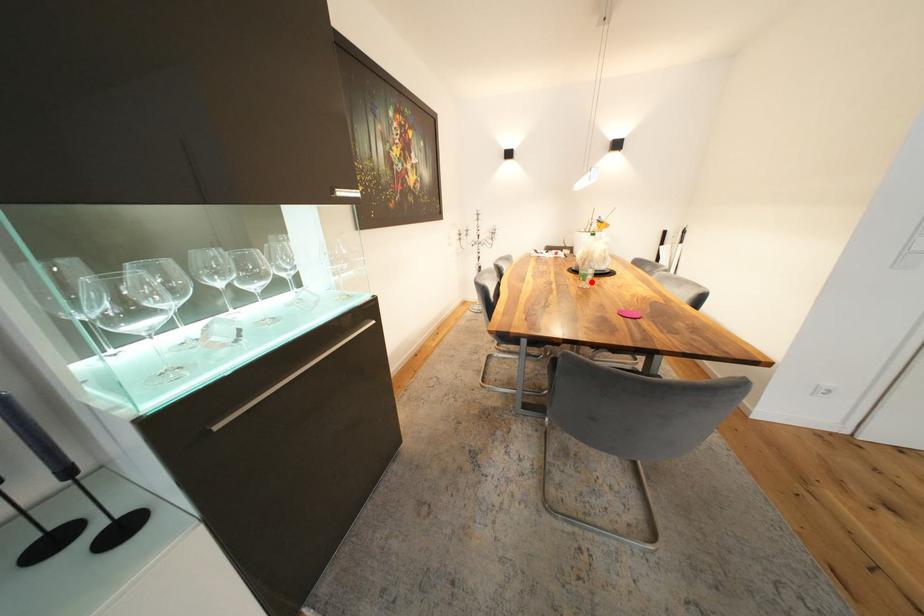
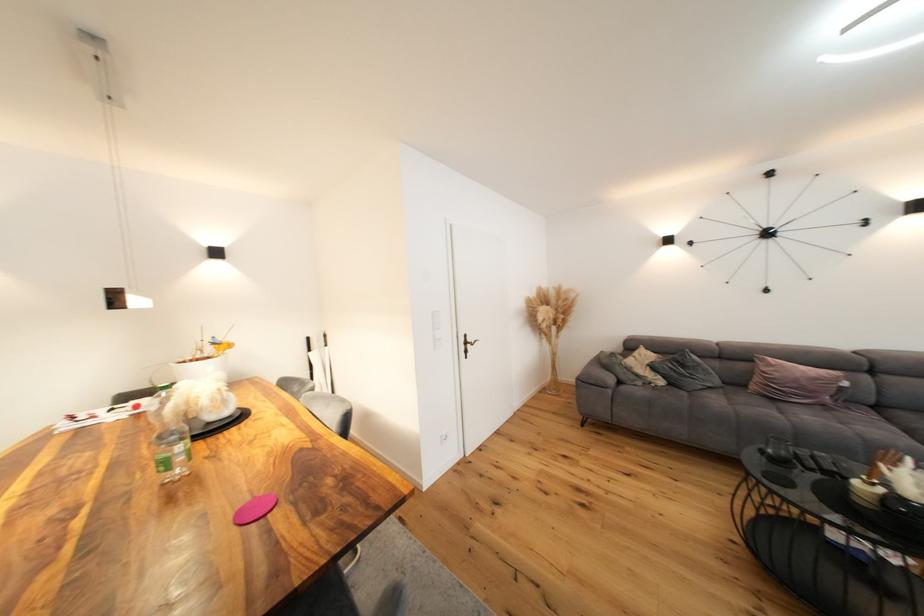
Find the pixel in the second image that matches the highlighted location in the first image.

(176, 469)